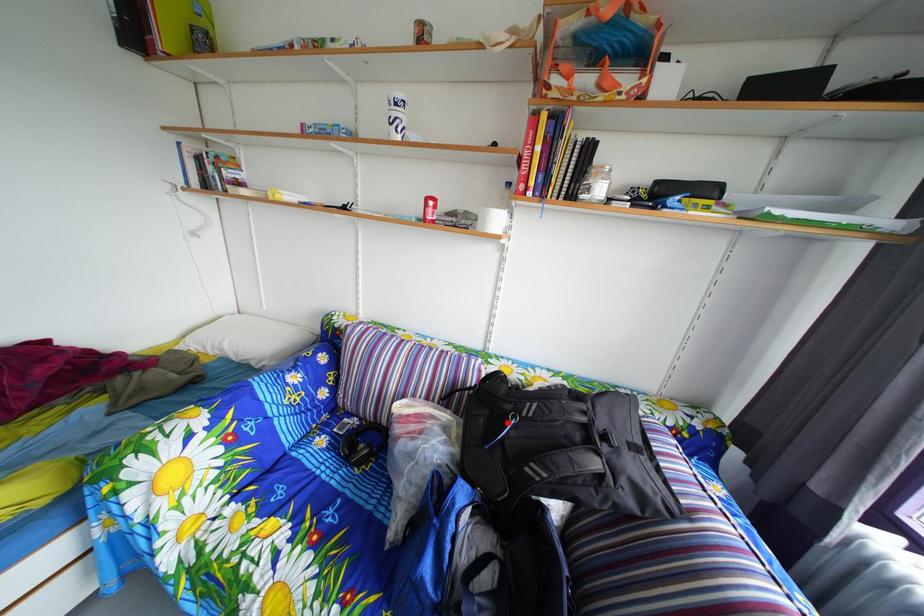
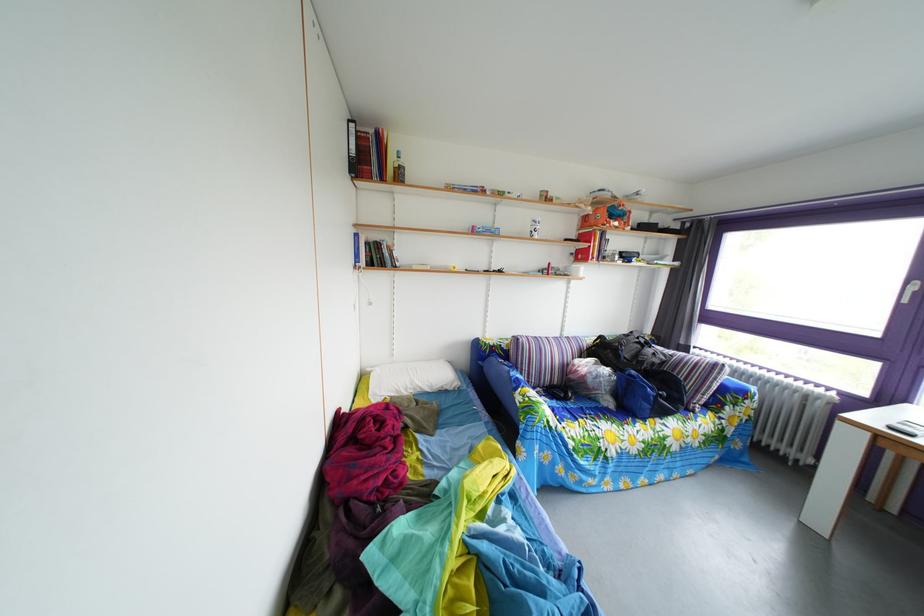
Question: I am providing you with two images of the same scene from different viewpoints. A red point is marked on the first image. Can you still see the location of the red point in image 2?

Choices:
 (A) Yes
 (B) No

Answer: (B)